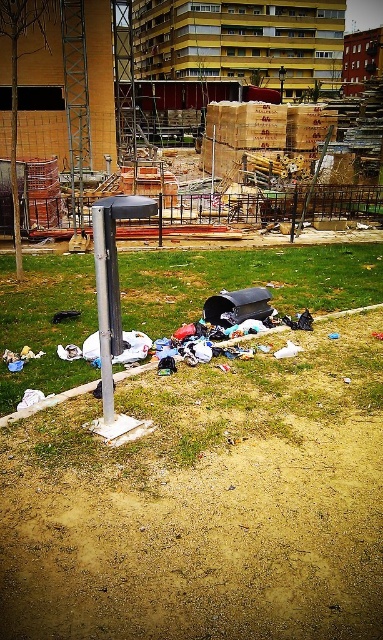
Where is `green grass at center`? green grass at center is located at coordinates (245, 280).

The width and height of the screenshot is (383, 640). What do you see at coordinates (245, 280) in the screenshot?
I see `green grass at center` at bounding box center [245, 280].

Based on the photo, who is more distant from viewer, (42, 291) or (98, 285)?

Positioned behind is point (42, 291).

Find the location of `green grass at center`. green grass at center is located at coordinates (245, 280).